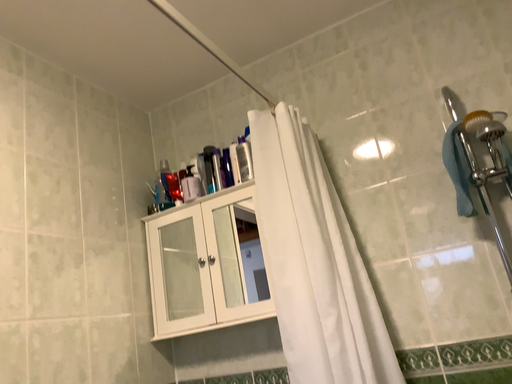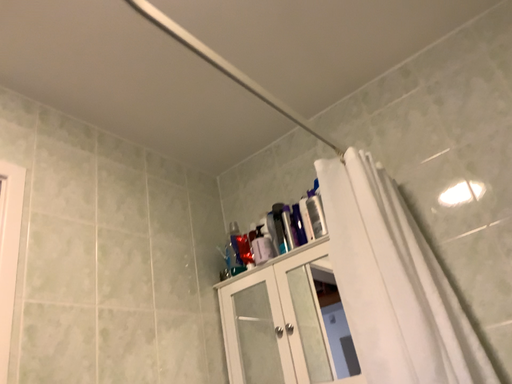
Question: How did the camera likely rotate when shooting the video?

Choices:
 (A) rotated downward
 (B) rotated upward

Answer: (B)